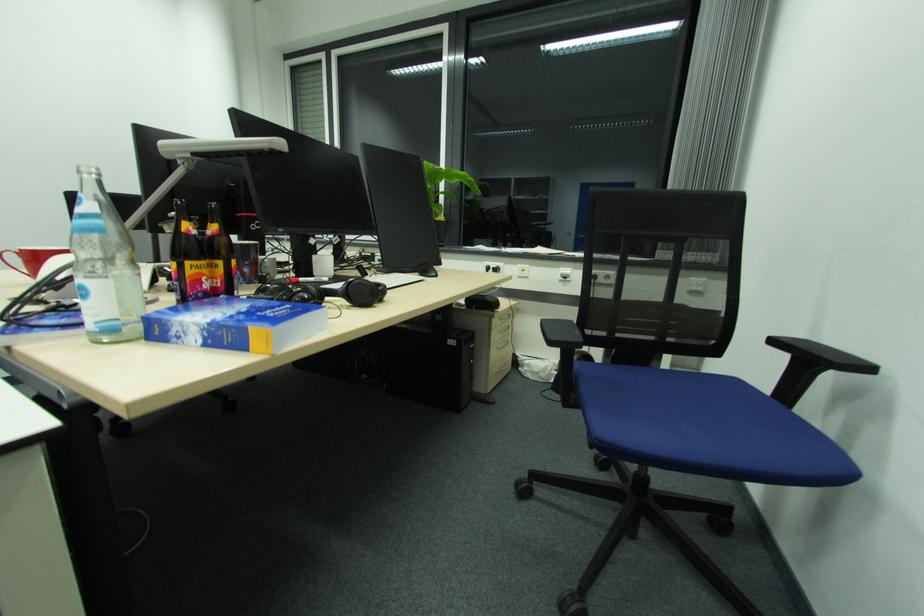
You are a GUI agent. You are given a task and a screenshot of the screen. Output one action in this format:
    pyautogui.click(x=<x>, y=<y>)
    Task: Click on the cabinet drawer handle
    The width and height of the screenshot is (924, 616).
    Given the screenshot: What is the action you would take?
    pyautogui.click(x=500, y=331)